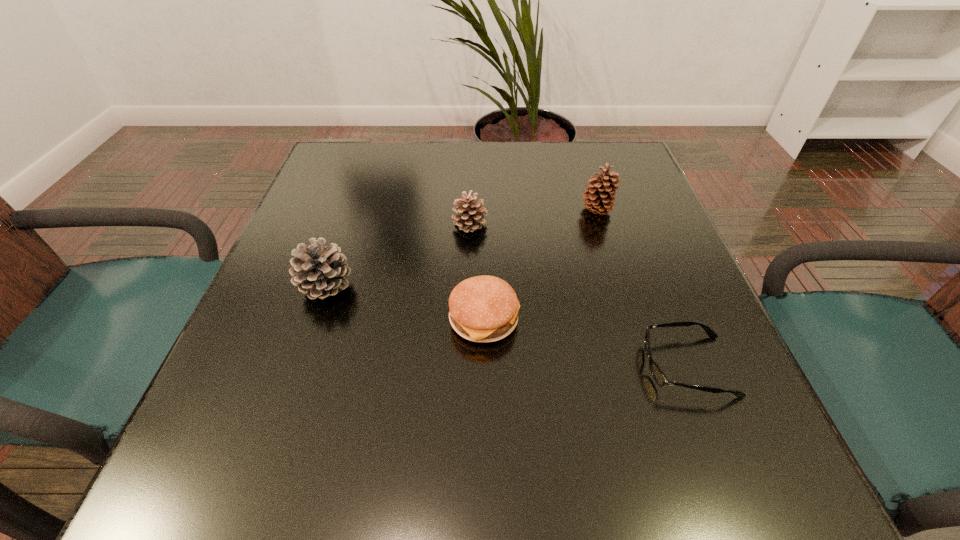
Locate an element on the screen. the rightmost pinecone is located at coordinates coord(599,199).

Find the location of a particular element. This screenshot has width=960, height=540. the nearest pinecone is located at coordinates (319, 271).

You are a GUI agent. You are given a task and a screenshot of the screen. Output one action in this format:
    pyautogui.click(x=<x>, y=<y>)
    Task: Click on the leftmost object
    Image resolution: width=960 pixels, height=540 pixels.
    Given the screenshot: What is the action you would take?
    pyautogui.click(x=319, y=271)

The width and height of the screenshot is (960, 540). What are the coordinates of `the shortest pinecone` in the screenshot? It's located at (470, 217).

Where is `hamburger`? hamburger is located at coordinates (483, 309).

Image resolution: width=960 pixels, height=540 pixels. I want to click on the shortest object, so click(x=658, y=375).

I want to click on vacant space situated 0.380m on the left of the rightmost pinecone, so pyautogui.click(x=410, y=211).

Locate an element on the screen. vacant space located on the front of the leftmost pinecone is located at coordinates (281, 417).

Where is `free space located on the front of the shortest pinecone`? free space located on the front of the shortest pinecone is located at coordinates (468, 262).

Find the location of a particular element. This screenshot has height=540, width=960. vacant space located on the back of the hamburger is located at coordinates (484, 260).